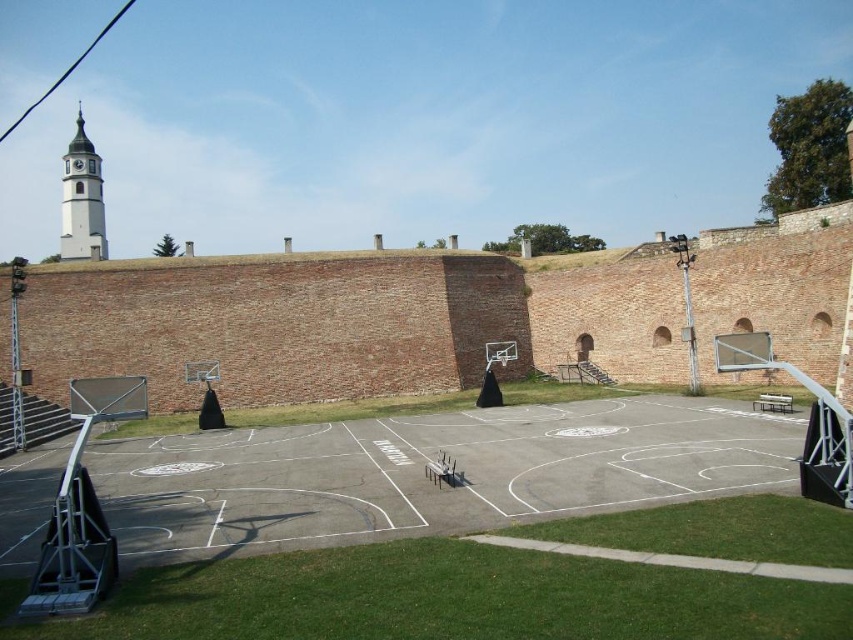
You are standing on the basketball court and want to take a photo of the clock tower. Since you need to frame both the smooth concrete basketball court at center and the white stucco clock tower at upper left in the same shot, which object should be placed in the foreground to ensure both are visible?

The smooth concrete basketball court at center is closer to the viewer than the white stucco clock tower at upper left. To frame both in the same shot, position the smooth concrete basketball court at center in the foreground, as it is nearer, allowing the white stucco clock tower at upper left to be in the background, ensuring both are visible in the photo.

You are a photographer trying to capture the smooth concrete basketball court at center and the white stucco clock tower at upper left in a single shot. Given that your camera has a fixed focal length, which object should you prioritize framing closer to the edge of the frame to ensure both are visible?

The smooth concrete basketball court at center is not as tall as the white stuccoco clock tower at upper left, so you should prioritize framing the smooth concrete basketball court at center closer to the edge of the frame to ensure both are visible.

You are a drone operator who needs to fly a drone from the smooth concrete basketball court at center to the white stucco clock tower at upper left. The drone has a maximum flight range of 100 meters. Can the drone reach the tower without needing to recharge?

The smooth concrete basketball court at center and white stucco clock tower at upper left are 96.26 meters apart. Since the drone can fly up to 100 meters, it can reach the tower without needing to recharge.